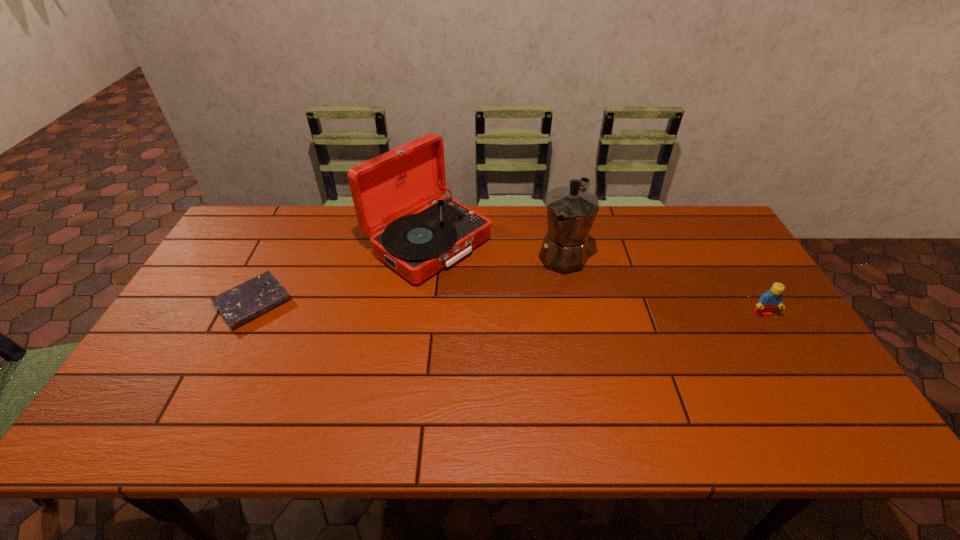
Find the location of `vacant space at the left edge`. vacant space at the left edge is located at coordinates (186, 303).

In the image, there is a desktop. Where is `blank space at the right edge`? The width and height of the screenshot is (960, 540). blank space at the right edge is located at coordinates (701, 260).

The image size is (960, 540). In order to click on blank space at the far left corner of the desktop in this screenshot , I will do `click(246, 246)`.

This screenshot has height=540, width=960. Identify the location of free location at the far right corner of the desktop. (683, 222).

Find the location of `vacant space at the near right corner`. vacant space at the near right corner is located at coordinates (774, 378).

Identify the location of vacant area between the second object from right to left and the third object from right to left. This screenshot has height=540, width=960. (495, 249).

Image resolution: width=960 pixels, height=540 pixels. Find the location of `free point between the Lego and the coffeepot`. free point between the Lego and the coffeepot is located at coordinates (662, 284).

This screenshot has height=540, width=960. I want to click on free space between the coffeepot and the Lego, so click(x=662, y=284).

Where is `vacant space in between the third object from right to left and the third tallest object`? The height and width of the screenshot is (540, 960). vacant space in between the third object from right to left and the third tallest object is located at coordinates (595, 279).

At what (x,y) coordinates should I click in order to perform the action: click on free space between the third object from right to left and the second object from right to left. Please return your answer as a coordinate pair (x, y). Image resolution: width=960 pixels, height=540 pixels. Looking at the image, I should click on (495, 249).